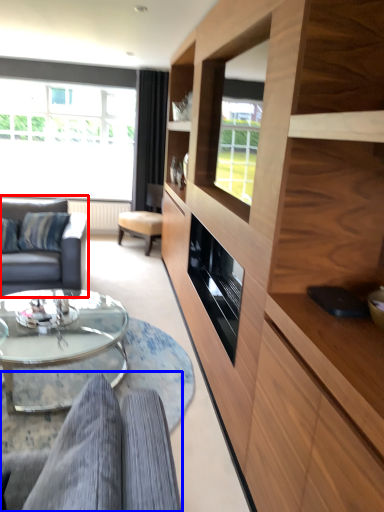
Question: Which object is closer to the camera taking this photo, studio couch (highlighted by a red box) or studio couch (highlighted by a blue box)?

Choices:
 (A) studio couch
 (B) studio couch

Answer: (B)